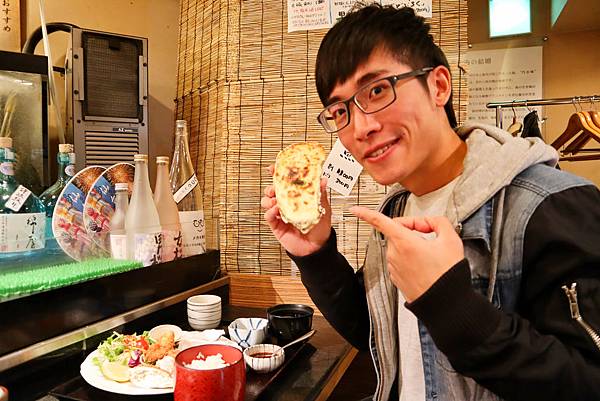
Identify the location of ceremic plate. The height and width of the screenshot is (401, 600). (119, 388).